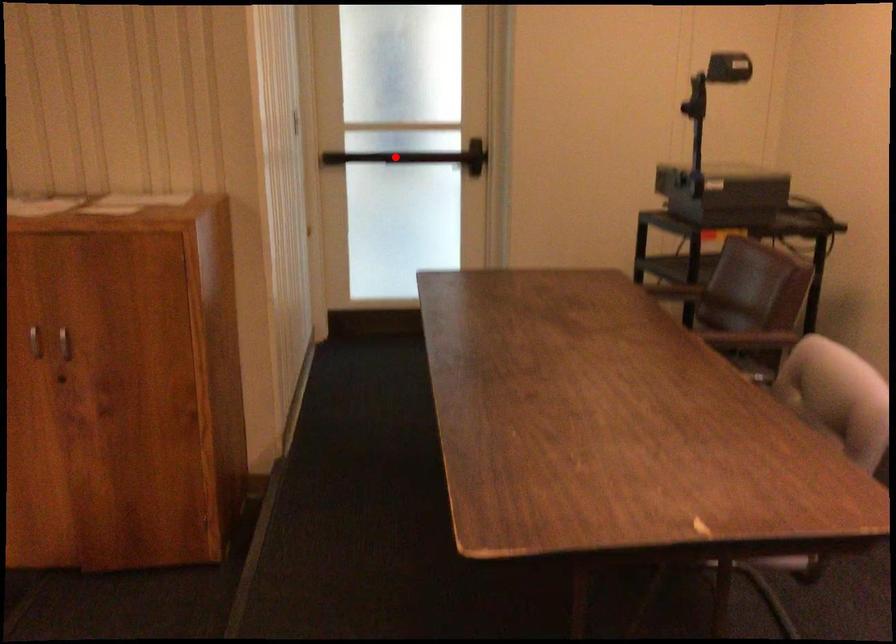
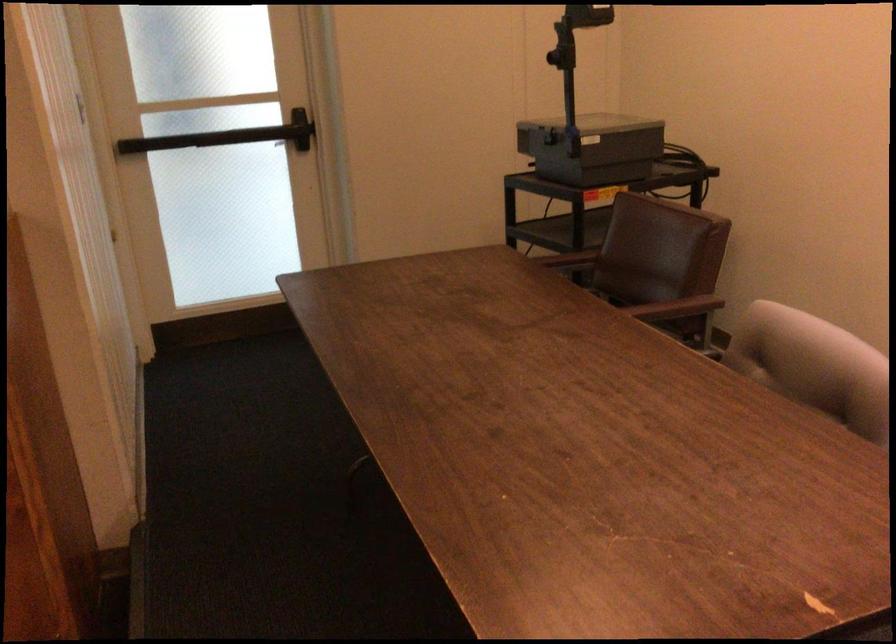
Question: A red point is marked in image1. In image2, is the corresponding 3D point closer to the camera or farther? Reply with the corresponding letter.

Choices:
 (A) The corresponding 3D point is closer.
 (B) The corresponding 3D point is farther.

Answer: (A)